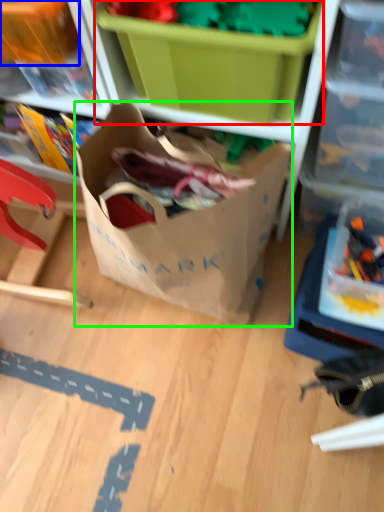
Question: Estimate the real-world distances between objects in this image. Which object is farther from storage box (highlighted by a red box), storage box (highlighted by a blue box) or bag (highlighted by a green box)?

Choices:
 (A) storage box
 (B) bag

Answer: (A)